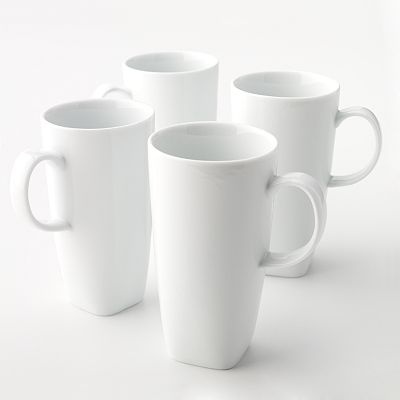
At what (x,y) coordinates should I click in order to perform the action: click on coffee cup handles. Please return your answer as a coordinate pair (x, y). The height and width of the screenshot is (400, 400). Looking at the image, I should click on (20, 183), (101, 90), (371, 118), (317, 214).